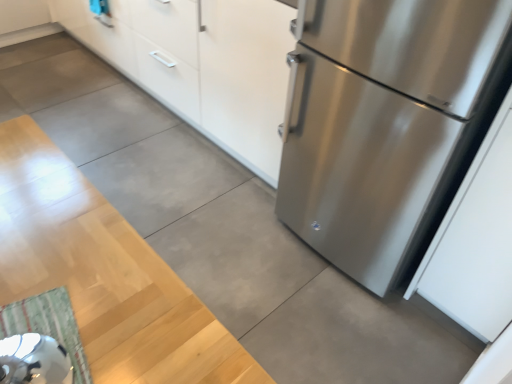
What is the approximate height of white matte cabinet at upper center?

It is 29.93 inches.

Locate an element on the screen. Image resolution: width=512 pixels, height=384 pixels. green striped rug at lower left is located at coordinates (48, 325).

Which is behind, point (331, 59) or point (28, 326)?

The point (28, 326) is farther from the camera.

Is stainless steel refrigerator at right wider or thinner than green striped rug at lower left?

Considering their sizes, stainless steel refrigerator at right looks broader than green striped rug at lower left.

Locate an element on the screen. The height and width of the screenshot is (384, 512). refrigerator that is in front of the green striped rug at lower left is located at coordinates (382, 123).

From the picture: From the image's perspective, would you say stainless steel refrigerator at right is positioned over green striped rug at lower left?

Yes, from the image's perspective, stainless steel refrigerator at right is over green striped rug at lower left.

Considering the relative sizes of green striped rug at lower left and stainless steel refrigerator at right in the image provided, is green striped rug at lower left shorter than stainless steel refrigerator at right?

Yes.

From the image's perspective, who appears lower, green striped rug at lower left or stainless steel refrigerator at right?

green striped rug at lower left appears lower in the image.

Does green striped rug at lower left touch stainless steel refrigerator at right?

No.

Which is in front, point (47, 300) or point (331, 152)?

Positioned in front is point (331, 152).

Is the depth of stainless steel refrigerator at right greater than that of white matte cabinet at upper center?

That is False.

At what (x,y) coordinates should I click in order to perform the action: click on refrigerator that is on the right side of white matte cabinet at upper center. Please return your answer as a coordinate pair (x, y). Image resolution: width=512 pixels, height=384 pixels. Looking at the image, I should click on (382, 123).

What's the angular difference between stainless steel refrigerator at right and white matte cabinet at upper center's facing directions?

0.399 degrees.

Is stainless steel refrigerator at right placed right next to white matte cabinet at upper center?

There is a gap between stainless steel refrigerator at right and white matte cabinet at upper center.

Does white matte cabinet at upper center appear on the right side of green striped rug at lower left?

Incorrect, white matte cabinet at upper center is not on the right side of green striped rug at lower left.

Between white matte cabinet at upper center and green striped rug at lower left, which one has less height?

With less height is green striped rug at lower left.

Is white matte cabinet at upper center inside or outside of green striped rug at lower left?

white matte cabinet at upper center exists outside the volume of green striped rug at lower left.

Is point (233, 23) more distant than point (470, 132)?

Yes.

Does white matte cabinet at upper center touch stainless steel refrigerator at right?

No, white matte cabinet at upper center is not touching stainless steel refrigerator at right.

Looking at this image, considering the positions of objects white matte cabinet at upper center and stainless steel refrigerator at right in the image provided, who is more to the right, white matte cabinet at upper center or stainless steel refrigerator at right?

stainless steel refrigerator at right is more to the right.

Based on the photo, does green striped rug at lower left have a lesser height compared to white matte cabinet at upper center?

Yes, green striped rug at lower left is shorter than white matte cabinet at upper center.

From the image's perspective, which is above, green striped rug at lower left or white matte cabinet at upper center?

white matte cabinet at upper center appears higher in the image.

Is green striped rug at lower left facing away from white matte cabinet at upper center?

green striped rug at lower left is not turned away from white matte cabinet at upper center.

Does green striped rug at lower left appear on the left side of white matte cabinet at upper center?

Incorrect, green striped rug at lower left is not on the left side of white matte cabinet at upper center.

Where is `doormat directly beneath the stainless steel refrigerator at right (from a real-world perspective)`? doormat directly beneath the stainless steel refrigerator at right (from a real-world perspective) is located at coordinates (48, 325).

Where is `refrigerator above the green striped rug at lower left (from a real-world perspective)`? This screenshot has height=384, width=512. refrigerator above the green striped rug at lower left (from a real-world perspective) is located at coordinates (382, 123).

From the image, which object appears to be nearer to green striped rug at lower left, stainless steel refrigerator at right or white matte cabinet at upper center?

Among the two, stainless steel refrigerator at right is located nearer to green striped rug at lower left.

From the image, which object appears to be farther from green striped rug at lower left, white matte cabinet at upper center or stainless steel refrigerator at right?

white matte cabinet at upper center is further to green striped rug at lower left.

When comparing their distances from stainless steel refrigerator at right, does green striped rug at lower left or white matte cabinet at upper center seem further?

Among the two, green striped rug at lower left is located further to stainless steel refrigerator at right.

Based on their spatial positions, is white matte cabinet at upper center or green striped rug at lower left closer to stainless steel refrigerator at right?

white matte cabinet at upper center.

Looking at the image, which one is located closer to white matte cabinet at upper center, stainless steel refrigerator at right or green striped rug at lower left?

Based on the image, stainless steel refrigerator at right appears to be nearer to white matte cabinet at upper center.

Which object lies further to the anchor point white matte cabinet at upper center, green striped rug at lower left or stainless steel refrigerator at right?

green striped rug at lower left.

The height and width of the screenshot is (384, 512). In order to click on refrigerator between white matte cabinet at upper center and green striped rug at lower left from top to bottom in this screenshot , I will do click(382, 123).